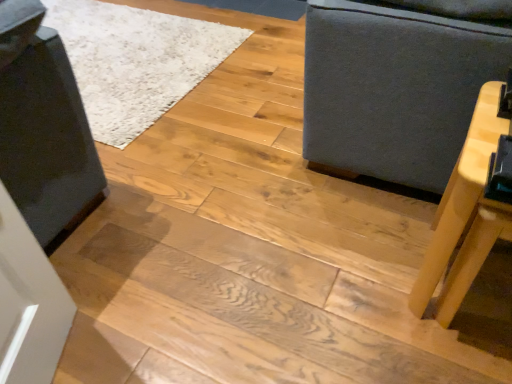
Question: Is gray fabric sofa at right outside of light wood table at right?

Choices:
 (A) no
 (B) yes

Answer: (B)

Question: Considering the relative sizes of gray fabric sofa at right and light wood table at right in the image provided, is gray fabric sofa at right shorter than light wood table at right?

Choices:
 (A) yes
 (B) no

Answer: (B)

Question: Is light wood table at right a part of gray fabric sofa at right?

Choices:
 (A) yes
 (B) no

Answer: (B)

Question: Considering the relative sizes of gray fabric sofa at right and light wood table at right in the image provided, is gray fabric sofa at right taller than light wood table at right?

Choices:
 (A) yes
 (B) no

Answer: (A)

Question: Does gray fabric sofa at right come in front of light wood table at right?

Choices:
 (A) yes
 (B) no

Answer: (B)

Question: From the image's perspective, is gray fabric sofa at right beneath light wood table at right?

Choices:
 (A) no
 (B) yes

Answer: (A)

Question: Is gray fabric sofa at right located within light wood table at right?

Choices:
 (A) no
 (B) yes

Answer: (A)

Question: Can you confirm if light wood table at right is positioned to the left of gray fabric sofa at right?

Choices:
 (A) no
 (B) yes

Answer: (B)

Question: Is light wood table at right positioned before gray fabric sofa at right?

Choices:
 (A) yes
 (B) no

Answer: (A)

Question: Is there a large distance between light wood table at right and gray fabric sofa at right?

Choices:
 (A) no
 (B) yes

Answer: (A)

Question: From a real-world perspective, is light wood table at right on gray fabric sofa at right?

Choices:
 (A) no
 (B) yes

Answer: (A)

Question: From the image's perspective, is light wood table at right located above gray fabric sofa at right?

Choices:
 (A) yes
 (B) no

Answer: (B)

Question: In terms of size, does light wood table at right appear bigger or smaller than gray fabric sofa at right?

Choices:
 (A) small
 (B) big

Answer: (A)